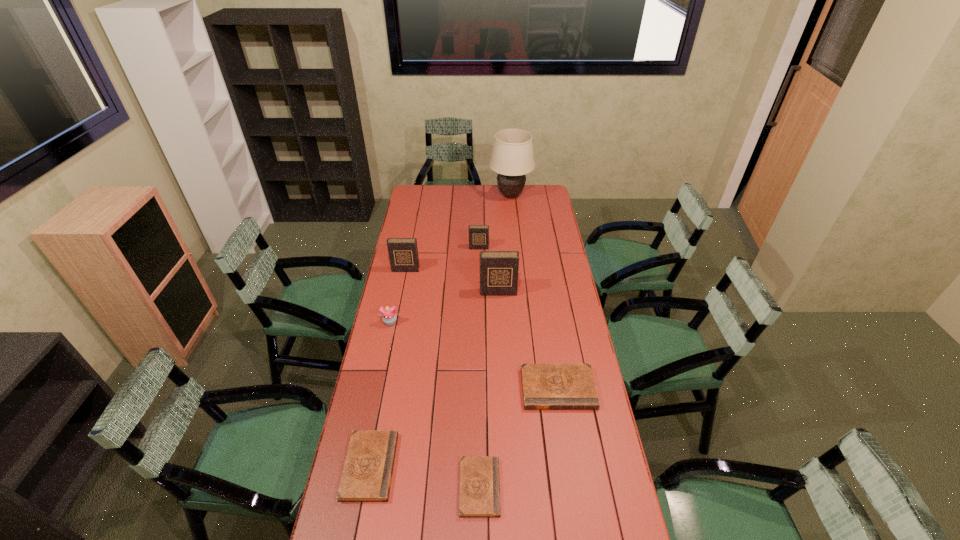
Identify the location of the biggest brown diary. This screenshot has width=960, height=540. (545, 386).

This screenshot has width=960, height=540. I want to click on the rightmost brown diary, so click(545, 386).

Where is `the leftmost brown diary`? the leftmost brown diary is located at coordinates (367, 473).

The height and width of the screenshot is (540, 960). What are the coordinates of `the second biggest brown diary` in the screenshot? It's located at (367, 473).

At what (x,y) coordinates should I click in order to perform the action: click on the smallest brown diary. Please return your answer as a coordinate pair (x, y). Looking at the image, I should click on (479, 496).

Where is `the shortest diary`? the shortest diary is located at coordinates (479, 496).

The height and width of the screenshot is (540, 960). Find the location of `free space located 0.190m on the left of the tallest object`. free space located 0.190m on the left of the tallest object is located at coordinates (458, 195).

I want to click on vacant space located 0.170m on the front cover of the seventh shortest object, so click(499, 322).

Find the location of `free point located 0.180m on the front cover of the sixth nearest object`. free point located 0.180m on the front cover of the sixth nearest object is located at coordinates (399, 298).

I want to click on vacant area situated 0.400m on the front cover of the third tallest diary, so click(478, 303).